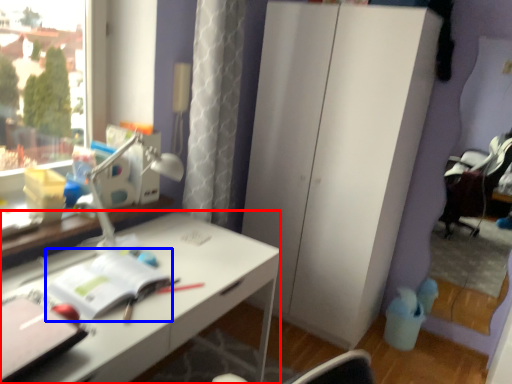
Question: Among these objects, which one is farthest to the camera, desk (highlighted by a red box) or notebook (highlighted by a blue box)?

Choices:
 (A) desk
 (B) notebook

Answer: (B)